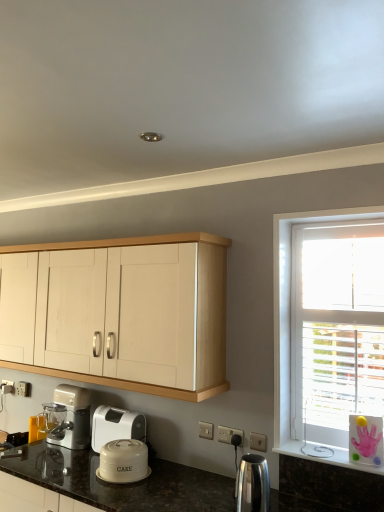
Question: Do you think polished stainless steel kettle at lower center, which appears as the second kitchen appliance when viewed from the left, is within light wood cabinet at upper center, or outside of it?

Choices:
 (A) outside
 (B) inside

Answer: (A)

Question: Relative to light wood cabinet at upper center, is polished stainless steel kettle at lower center, acting as the 1th kitchen appliance starting from the right, in front or behind?

Choices:
 (A) behind
 (B) front

Answer: (B)

Question: Estimate the real-world distances between objects in this image. Which object is closer to the matte silver blender at lower left, positioned as the 2th home appliance in right-to-left order?

Choices:
 (A) light wood cabinet at upper center
 (B) white plastic container at lower center, marked as the 2th home appliance in a left-to-right arrangement
 (C) polished stainless steel kettle at lower center, the first kitchen appliance in the front-to-back sequence
 (D) matte white cake container at lower center, which appears as the 2th kitchen appliance when viewed from the front
 (E) white plastic electric outlet at lower center

Answer: (B)

Question: Which object is positioned farthest from the light wood cabinet at upper center?

Choices:
 (A) white plastic electric outlet at lower center
 (B) matte silver blender at lower left, which is counted as the 1th home appliance, starting from the left
 (C) polished stainless steel kettle at lower center, the first kitchen appliance in the front-to-back sequence
 (D) white plastic container at lower center, arranged as the 1th home appliance when viewed from the right
 (E) matte white cake container at lower center, the 1th kitchen appliance positioned from the left

Answer: (C)